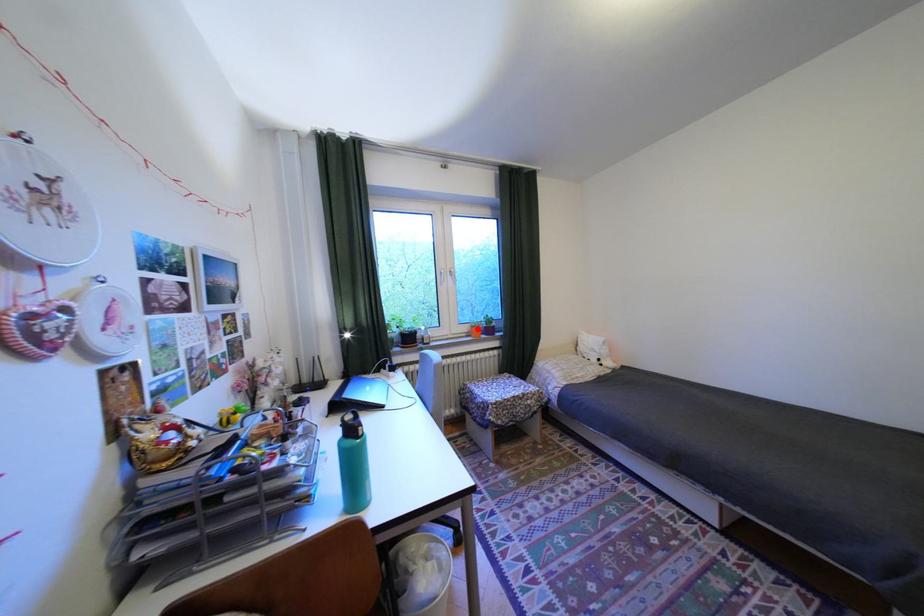
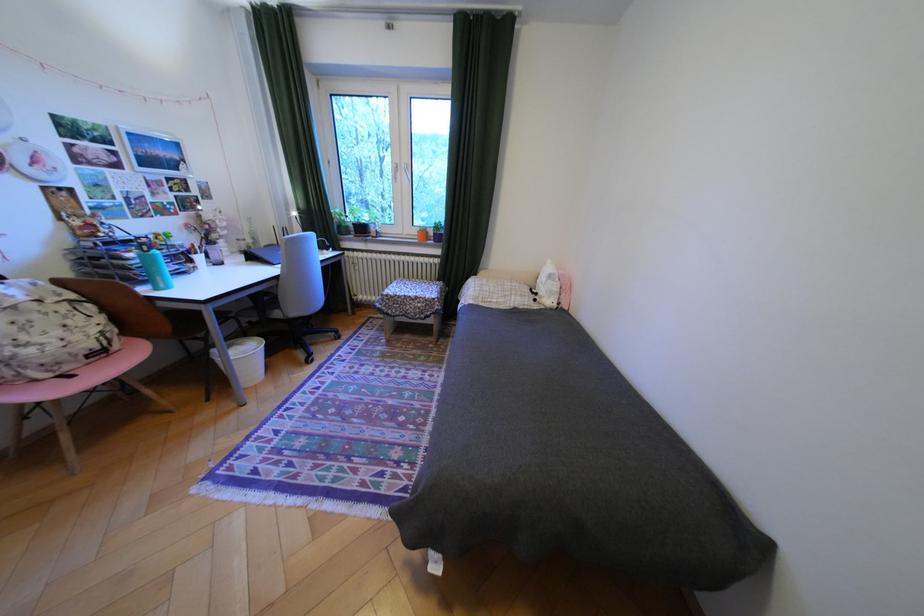
In the second image, find the point that corresponds to the highlighted location in the first image.

(427, 232)